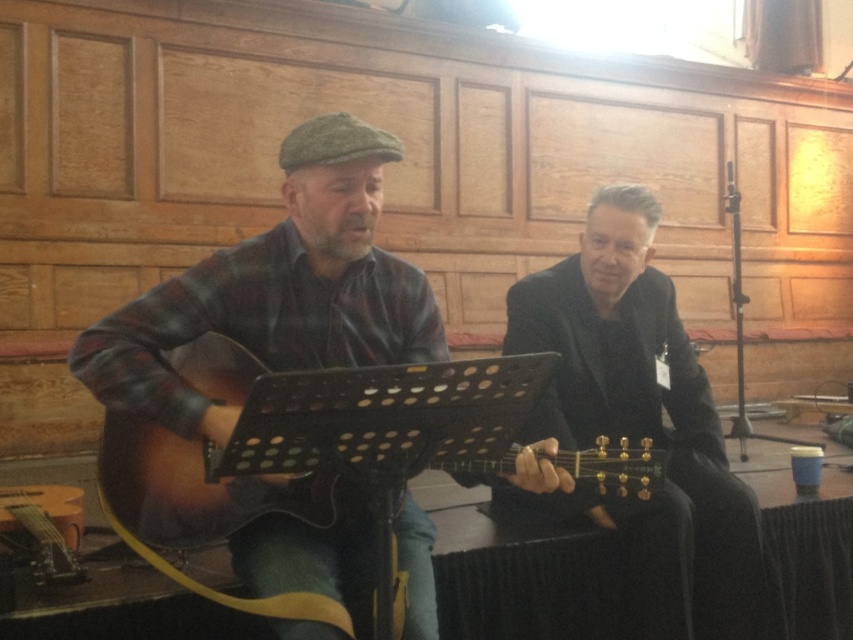
Question: Does matte plaid shirt at center lie behind black glossy suit at center?

Choices:
 (A) yes
 (B) no

Answer: (B)

Question: Estimate the real-world distances between objects in this image. Which object is farther from the sunburst wood guitar at center?

Choices:
 (A) matte plaid shirt at center
 (B) black glossy suit at center

Answer: (B)

Question: Which point appears farthest from the camera in this image?

Choices:
 (A) (273, 560)
 (B) (689, 577)
 (C) (537, 372)

Answer: (B)

Question: Is the position of black glossy suit at center less distant than that of sunburst wood guitar at center?

Choices:
 (A) yes
 (B) no

Answer: (B)

Question: Which object appears farthest from the camera in this image?

Choices:
 (A) black glossy suit at center
 (B) sunburst wood guitar at center

Answer: (A)

Question: Is matte plaid shirt at center bigger than sunburst wood guitar at center?

Choices:
 (A) no
 (B) yes

Answer: (A)